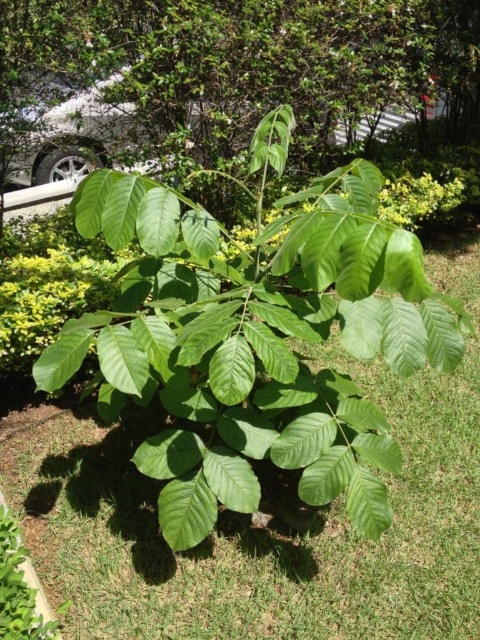
Question: Which object appears closest to the camera in this image?

Choices:
 (A) green grass at center
 (B) green leafy tree at center
 (C) silver metallic car at upper left

Answer: (A)

Question: Among these points, which one is farthest from the camera?

Choices:
 (A) (98, 156)
 (B) (16, 442)

Answer: (A)

Question: In this image, where is green grass at center located relative to green leafy tree at center?

Choices:
 (A) left
 (B) right

Answer: (A)

Question: Which object is positioned closest to the silver metallic car at upper left?

Choices:
 (A) green leafy tree at center
 (B) green grass at center

Answer: (A)

Question: Observing the image, what is the correct spatial positioning of green grass at center in reference to green leafy tree at center?

Choices:
 (A) left
 (B) right

Answer: (A)

Question: Does green grass at center appear on the left side of green leafy tree at center?

Choices:
 (A) no
 (B) yes

Answer: (B)